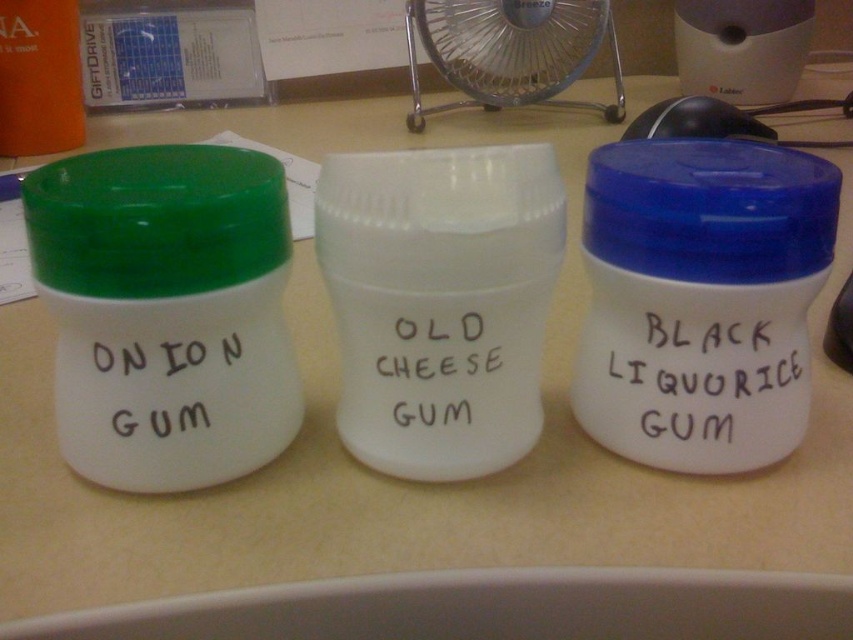
Question: Which object appears closest to the camera in this image?

Choices:
 (A) metallic silver fan at center
 (B) black matte gum at center
 (C) blue plastic lid at center
 (D) green matte lid at left

Answer: (D)

Question: Is green matte lid at left wider than black matte gum at center?

Choices:
 (A) no
 (B) yes

Answer: (B)

Question: Does black matte gum at center lie behind white matte text at center?

Choices:
 (A) no
 (B) yes

Answer: (B)

Question: Based on their relative distances, which object is nearer to the blue plastic lid at center?

Choices:
 (A) white matte text at center
 (B) black matte gum at center
 (C) green matte lid at left
 (D) black handwritten text at center

Answer: (B)

Question: Does metallic silver fan at center appear under black plastic mouse at upper center?

Choices:
 (A) no
 (B) yes

Answer: (A)

Question: Among these points, which one is farthest from the camera?

Choices:
 (A) (790, 444)
 (B) (676, 99)

Answer: (B)